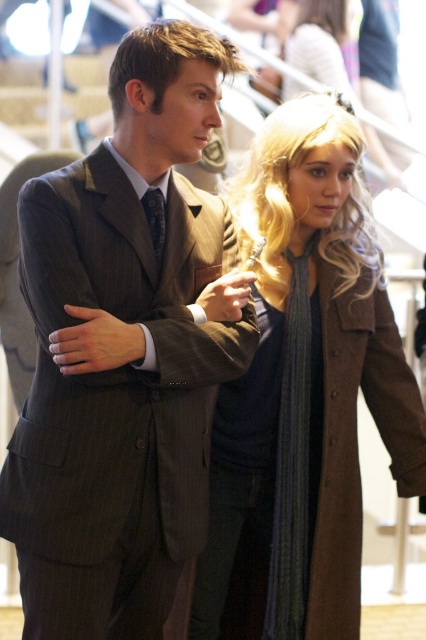
Is point (146, 563) positioned after point (218, 580)?

No.

Where is `pinstriped wool suit at center`? This screenshot has height=640, width=426. pinstriped wool suit at center is located at coordinates (124, 352).